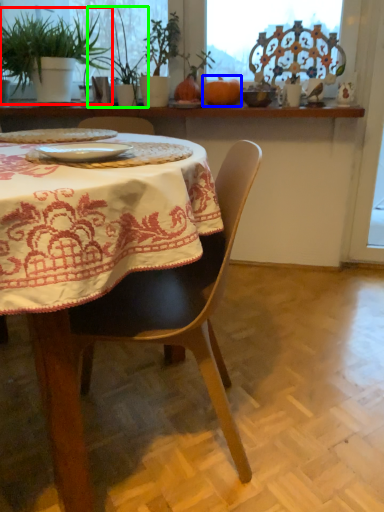
Question: Which object is positioned farthest from houseplant (highlighted by a red box)? Select from pumpkin (highlighted by a blue box) and plant (highlighted by a green box).

Choices:
 (A) pumpkin
 (B) plant

Answer: (A)